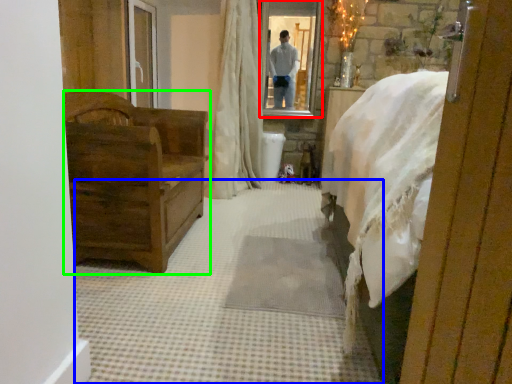
Question: Which is farther away from mirror (highlighted by a red box)? plain (highlighted by a blue box) or furniture (highlighted by a green box)?

Choices:
 (A) plain
 (B) furniture

Answer: (A)